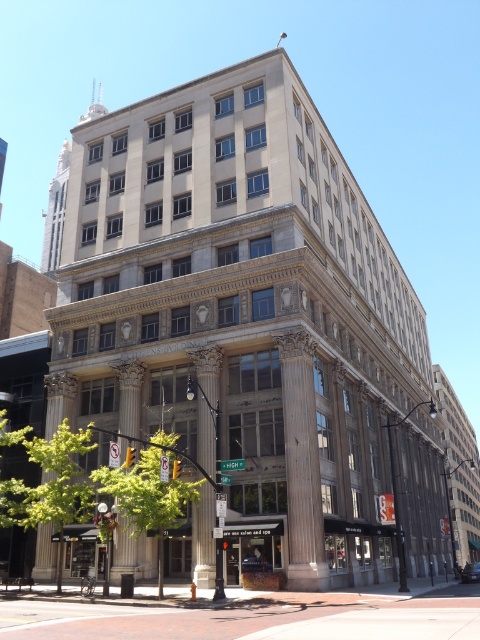
Between polished stone column at center and white marble pillar at center, which one has more height?

Standing taller between the two is polished stone column at center.

Can you confirm if polished stone column at center is positioned below white marble pillar at center?

Incorrect, polished stone column at center is not positioned below white marble pillar at center.

This screenshot has height=640, width=480. Find the location of `polished stone column at center`. polished stone column at center is located at coordinates (130, 396).

Is point (204, 497) in front of point (121, 362)?

Yes, point (204, 497) is in front of point (121, 362).

Who is more forward, (218,365) or (120,544)?

Point (120,544) is more forward.

Locate an element on the screen. This screenshot has width=480, height=640. smooth stone column at center is located at coordinates (206, 403).

Between brown polished stone column at center and smooth stone column at center, which one has more height?

brown polished stone column at center

Is point (297, 508) closer to camera compared to point (215, 476)?

That is True.

The height and width of the screenshot is (640, 480). I want to click on brown polished stone column at center, so click(301, 464).